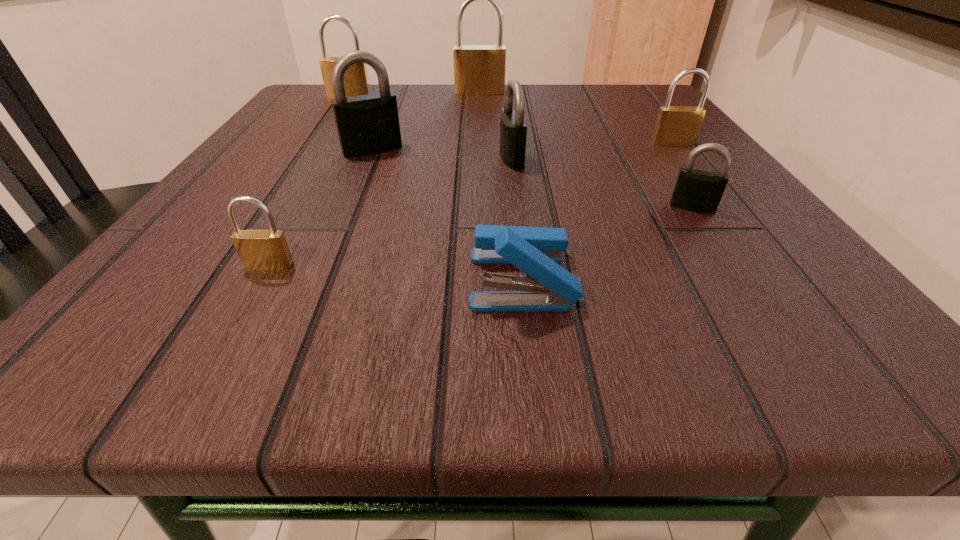
Locate an element on the screen. the second closest black padlock relative to the second nearest padlock is located at coordinates (368, 124).

This screenshot has width=960, height=540. I want to click on free space that satisfies the following two spatial constraints: 1. on the front-facing side of the tallest object; 2. on the left side of the stapler, so [x=479, y=280].

The width and height of the screenshot is (960, 540). I want to click on free spot that satisfies the following two spatial constraints: 1. on the front-facing side of the sixth farthest object; 2. on the left side of the tallest padlock, so click(479, 207).

You are a GUI agent. You are given a task and a screenshot of the screen. Output one action in this format:
    pyautogui.click(x=<x>, y=<y>)
    Task: Click on the free location that satisfies the following two spatial constraints: 1. on the front-facing side of the third smallest brass padlock; 2. on the left side of the second nearest padlock
    This screenshot has width=960, height=540.
    Given the screenshot: What is the action you would take?
    pyautogui.click(x=278, y=207)

Find the location of a particular element. This screenshot has height=540, width=960. free space in the image that satisfies the following two spatial constraints: 1. on the front-facing side of the second biggest brass padlock; 2. on the left side of the second biggest black padlock is located at coordinates (309, 159).

Find the location of a particular element. The width and height of the screenshot is (960, 540). free space that satisfies the following two spatial constraints: 1. on the front-facing side of the smallest brass padlock; 2. on the left side of the blue stapler is located at coordinates (262, 280).